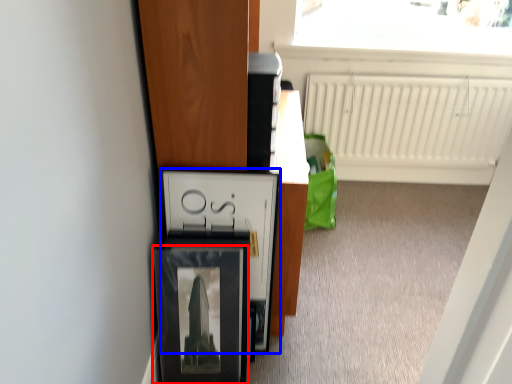
Question: Which point is further to the camera, picture frame (highlighted by a red box) or cabinetry (highlighted by a blue box)?

Choices:
 (A) picture frame
 (B) cabinetry

Answer: (B)